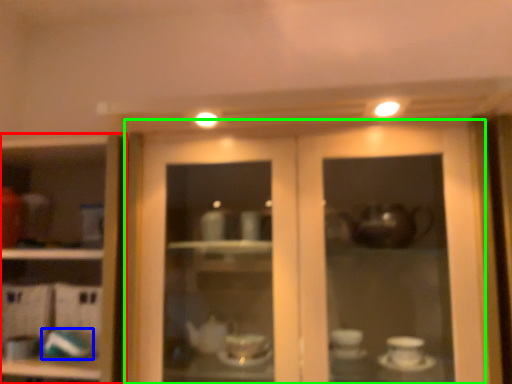
Question: Which object is the farthest from cupboard (highlighted by a red box)? Choose among these: tableware (highlighted by a blue box) or door (highlighted by a green box).

Choices:
 (A) tableware
 (B) door

Answer: (B)